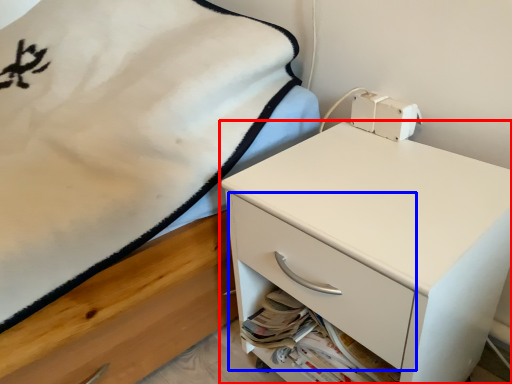
Question: Which of the following is the closest to the observer, chest of drawers (highlighted by a red box) or drawer (highlighted by a blue box)?

Choices:
 (A) chest of drawers
 (B) drawer

Answer: (A)